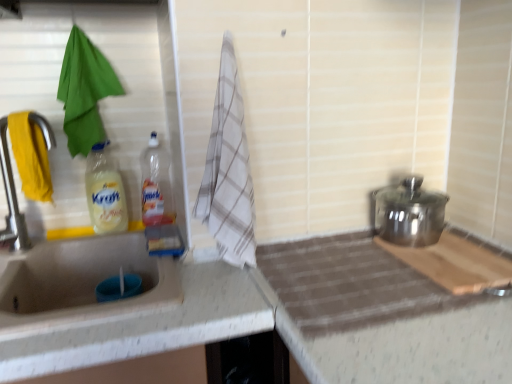
Question: Is matte silver tap at left looking in the opposite direction of green fabric towel at left, the 1th beach towel in the back-to-front sequence?

Choices:
 (A) yes
 (B) no

Answer: (A)

Question: Considering the relative sizes of matte silver tap at left and green fabric towel at left, the 1th beach towel in the back-to-front sequence, in the image provided, is matte silver tap at left shorter than green fabric towel at left, the 1th beach towel in the back-to-front sequence,?

Choices:
 (A) no
 (B) yes

Answer: (B)

Question: From a real-world perspective, is matte silver tap at left located higher than green fabric towel at left, positioned as the 1th beach towel in left-to-right order?

Choices:
 (A) no
 (B) yes

Answer: (A)

Question: Does matte silver tap at left lie in front of green fabric towel at left, the 1th beach towel in the back-to-front sequence?

Choices:
 (A) yes
 (B) no

Answer: (A)

Question: Can you confirm if matte silver tap at left is positioned to the right of green fabric towel at left, which is the second beach towel in right-to-left order?

Choices:
 (A) yes
 (B) no

Answer: (B)

Question: Based on their positions, is matte silver tap at left located to the left or right of white checkered towel at center, the first beach towel from the right?

Choices:
 (A) right
 (B) left

Answer: (B)

Question: Considering the positions of matte silver tap at left and white checkered towel at center, the 2th beach towel from the back, in the image, is matte silver tap at left wider or thinner than white checkered towel at center, the 2th beach towel from the back,?

Choices:
 (A) thin
 (B) wide

Answer: (A)

Question: From a real-world perspective, is matte silver tap at left above or below white checkered towel at center, the 2th beach towel from the back?

Choices:
 (A) above
 (B) below

Answer: (B)

Question: Considering the positions of matte silver tap at left and white checkered towel at center, the 2th beach towel from the back, in the image, is matte silver tap at left taller or shorter than white checkered towel at center, the 2th beach towel from the back,?

Choices:
 (A) short
 (B) tall

Answer: (A)

Question: From the image's perspective, relative to translucent plastic bottle at center, positioned as the 1th bottle in right-to-left order, is green fabric towel at left, which is the second beach towel in right-to-left order, above or below?

Choices:
 (A) below
 (B) above

Answer: (B)

Question: From a real-world perspective, is green fabric towel at left, which is the second beach towel in right-to-left order, physically located above or below translucent plastic bottle at center, positioned as the 1th bottle in right-to-left order?

Choices:
 (A) above
 (B) below

Answer: (A)

Question: Considering the positions of green fabric towel at left, positioned as the second beach towel in front-to-back order, and translucent plastic bottle at center, placed as the second bottle when sorted from left to right, in the image, is green fabric towel at left, positioned as the second beach towel in front-to-back order, wider or thinner than translucent plastic bottle at center, placed as the second bottle when sorted from left to right,?

Choices:
 (A) thin
 (B) wide

Answer: (A)

Question: Does point (74, 61) appear closer or farther from the camera than point (161, 192)?

Choices:
 (A) closer
 (B) farther

Answer: (A)

Question: Looking at their shapes, would you say polished stainless steel pot at right is wider or thinner than white checkered towel at center, the 2th beach towel from the back?

Choices:
 (A) thin
 (B) wide

Answer: (B)

Question: Does point (445, 198) appear closer or farther from the camera than point (220, 119)?

Choices:
 (A) farther
 (B) closer

Answer: (A)